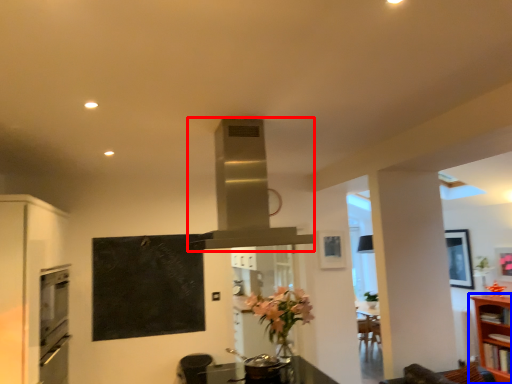
Question: Which of the following is the farthest to the observer, exhaust hood (highlighted by a red box) or shelf (highlighted by a blue box)?

Choices:
 (A) exhaust hood
 (B) shelf

Answer: (B)